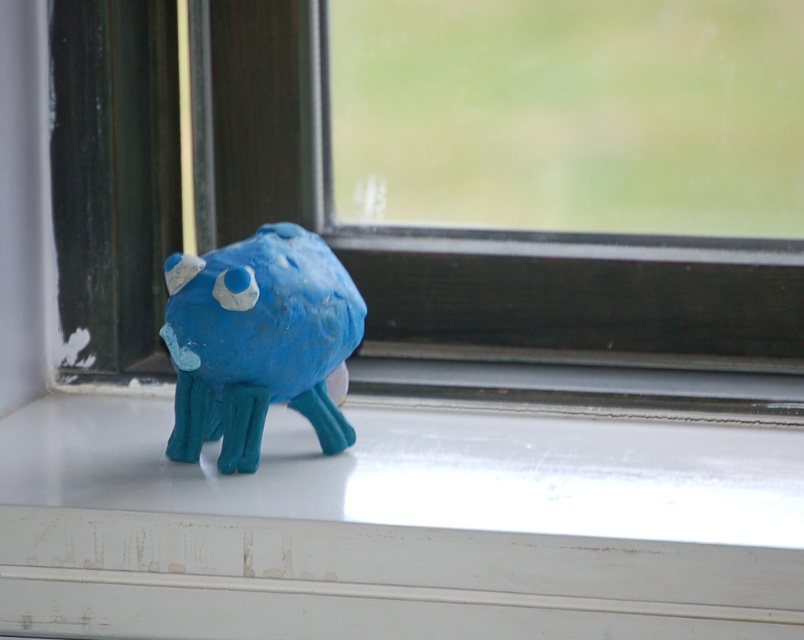
Who is shorter, white painted wood at center or matte black window frame at center?

With less height is white painted wood at center.

Between white painted wood at center and matte black window frame at center, which one has more height?

With more height is matte black window frame at center.

You are a GUI agent. You are given a task and a screenshot of the screen. Output one action in this format:
    pyautogui.click(x=<x>, y=<y>)
    Task: Click on the white painted wood at center
    This screenshot has height=640, width=804.
    Given the screenshot: What is the action you would take?
    pyautogui.click(x=398, y=525)

At what (x,y) coordinates should I click in order to perform the action: click on white painted wood at center. Please return your answer as a coordinate pair (x, y). The image size is (804, 640). Looking at the image, I should click on (398, 525).

Can you confirm if matte black window frame at center is smaller than matte clay monster at center?

Answer: No.

Is point (257, 104) positioned before point (195, 317)?

No.

This screenshot has height=640, width=804. In order to click on matte black window frame at center in this screenshot , I will do click(470, 236).

Does white painted wood at center have a greater width compared to matte clay monster at center?

Yes.

Does white painted wood at center have a larger size compared to matte clay monster at center?

Yes.

Who is more forward, [579,627] or [240,289]?

Point [579,627] is more forward.

Locate an element on the screen. The height and width of the screenshot is (640, 804). white painted wood at center is located at coordinates (398, 525).